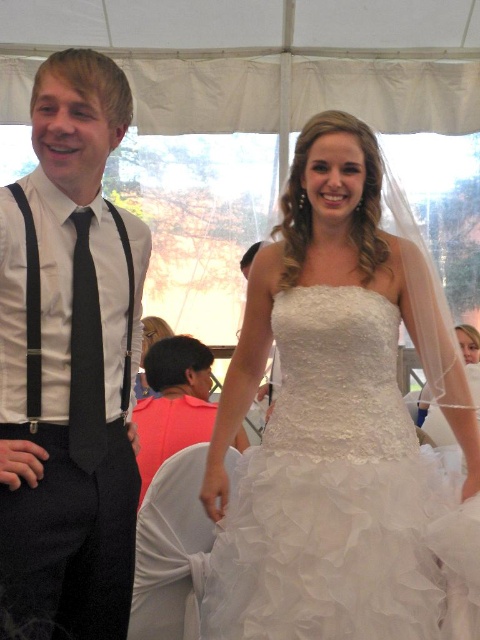
Which is more to the right, pink fabric shirt at center or black satin tie at left?

From the viewer's perspective, pink fabric shirt at center appears more on the right side.

Is pink fabric shirt at center smaller than black satin tie at left?

Incorrect, pink fabric shirt at center is not smaller in size than black satin tie at left.

Image resolution: width=480 pixels, height=640 pixels. In order to click on pink fabric shirt at center in this screenshot , I will do `click(172, 403)`.

Which of these two, matte black tie at left or pink fabric shirt at center, stands shorter?

pink fabric shirt at center is shorter.

This screenshot has height=640, width=480. In order to click on matte black tie at left in this screenshot , I will do `click(70, 362)`.

Where is `matte black tie at left`? matte black tie at left is located at coordinates (70, 362).

Who is taller, white lace dress at center or pink fabric shirt at center?

Standing taller between the two is white lace dress at center.

Is white lace dress at center further to camera compared to pink fabric shirt at center?

That is False.

Image resolution: width=480 pixels, height=640 pixels. What are the coordinates of `white lace dress at center` in the screenshot? It's located at (334, 416).